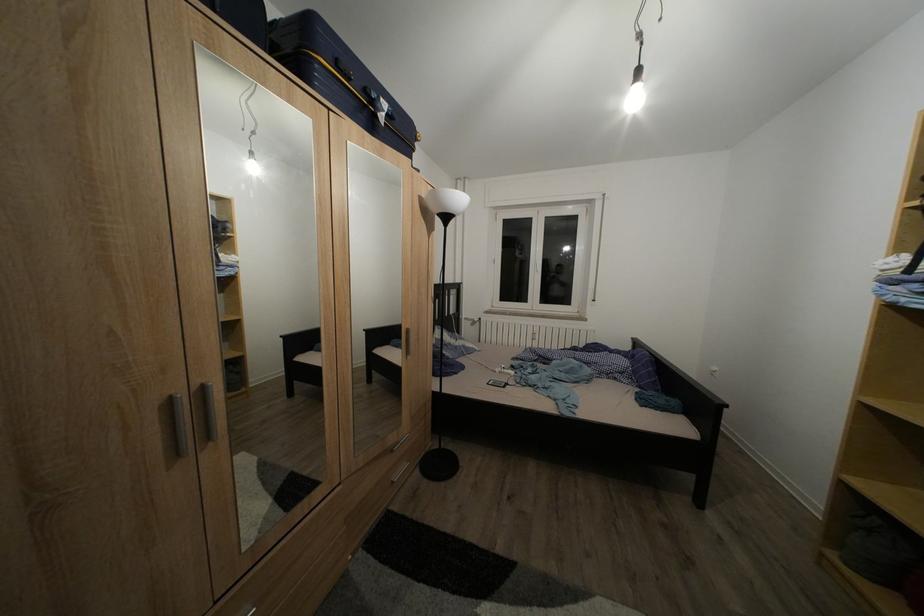
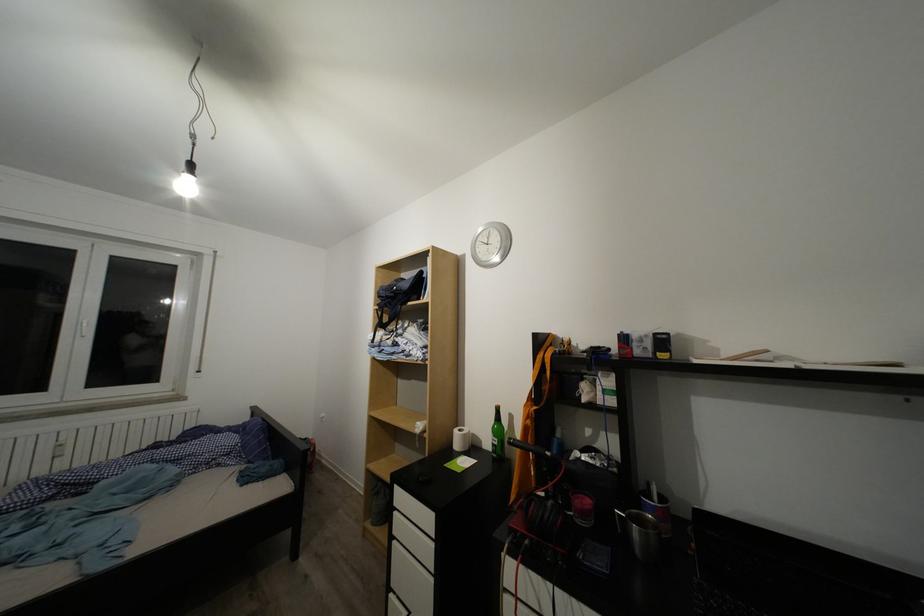
Where in the second image is the point corresponding to (x=641, y=107) from the first image?

(193, 195)